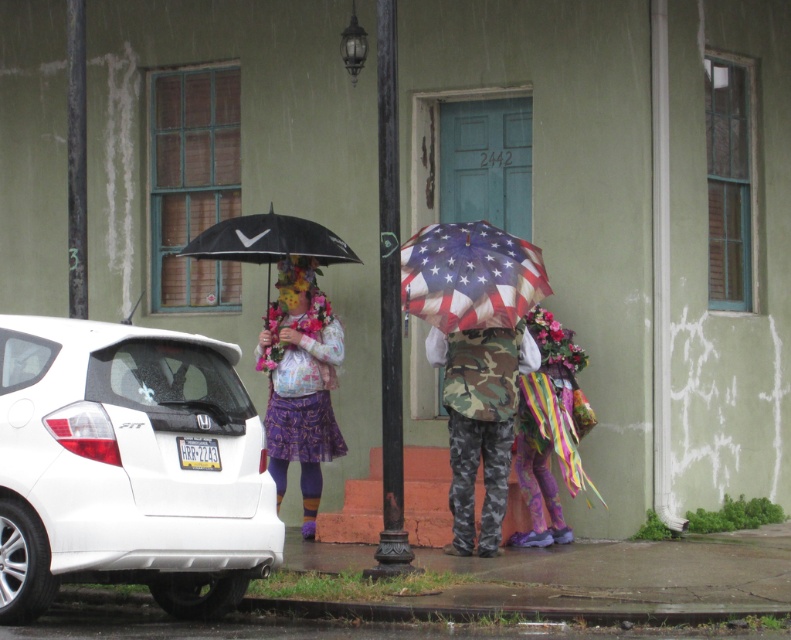
You are a fashion designer observing a person in the rainy street scene. You notice the matte floral skirt at center and the camouflage fabric pants at center. Which piece of clothing is positioned to the left?

The matte floral skirt at center is to the left of the camouflage fabric pants at center.

In the scene shown: You are standing on the red brick steps in front of the blue door. You see a white matte car at left and camouflage fabric pants at center. Which object is closer to your right side?

The camouflage fabric pants at center is closer to your right side because the white matte car at left is positioned on the left side of camouflage fabric pants at center.